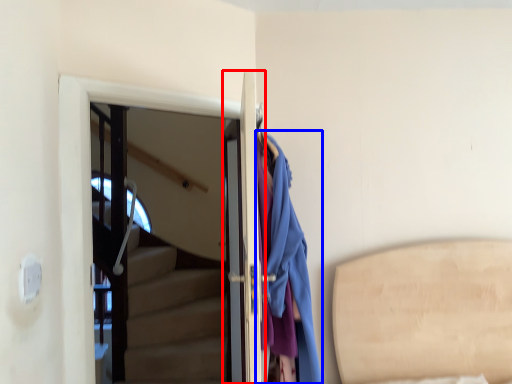
Question: Which object is closer to the camera taking this photo, door (highlighted by a red box) or clothing (highlighted by a blue box)?

Choices:
 (A) door
 (B) clothing

Answer: (B)